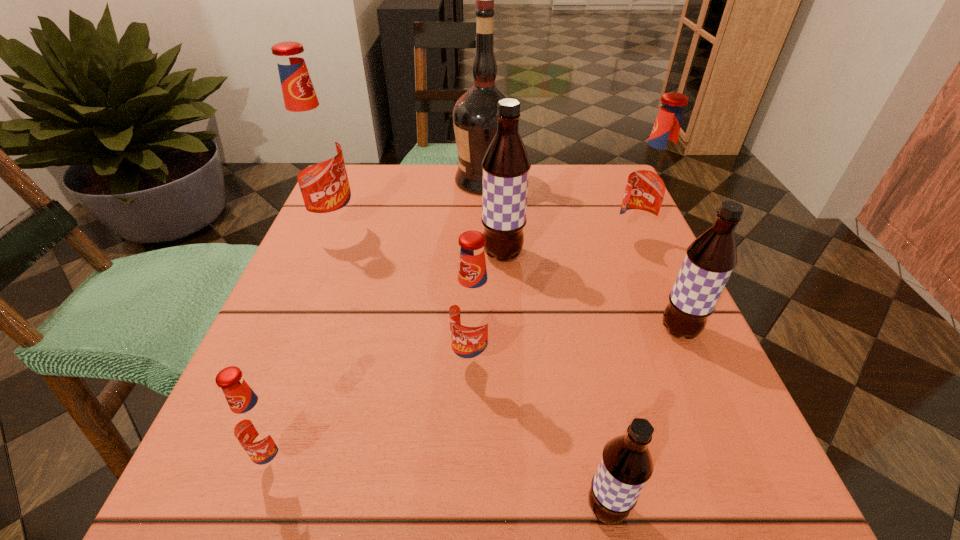
Where is `blank space located on the right of the second nearest red root beer`? blank space located on the right of the second nearest red root beer is located at coordinates (711, 363).

Identify the location of free space located 0.240m on the right of the second nearest root beer. (487, 460).

You are a GUI agent. You are given a task and a screenshot of the screen. Output one action in this format:
    pyautogui.click(x=<x>, y=<y>)
    Task: Click on the vacant region located on the back of the third object from right to left
    
    Given the screenshot: What is the action you would take?
    [x=585, y=400]

Locate an element on the screen. The width and height of the screenshot is (960, 540). liquor positioned at the far edge is located at coordinates (474, 115).

This screenshot has width=960, height=540. Find the location of `root beer at the far edge`. root beer at the far edge is located at coordinates (314, 153).

You are a GUI agent. You are given a task and a screenshot of the screen. Output one action in this format:
    pyautogui.click(x=<x>, y=<y>)
    Task: Click on the object located in the far left corner section of the desktop
    The width and height of the screenshot is (960, 540).
    Given the screenshot: What is the action you would take?
    pyautogui.click(x=314, y=153)

Identify the location of object located in the near left corner section of the desktop. This screenshot has width=960, height=540. (257, 424).

Where is `free spot at the far edge of the desktop`? The image size is (960, 540). free spot at the far edge of the desktop is located at coordinates (555, 186).

You are a GUI agent. You are given a task and a screenshot of the screen. Output one action in this format:
    pyautogui.click(x=<x>, y=<y>)
    Task: Click on the vacant space at the near edge of the desktop
    Image resolution: width=960 pixels, height=540 pixels.
    Given the screenshot: What is the action you would take?
    tap(457, 505)

In the image, there is a desktop. Identify the location of vacant space at the left edge. (303, 252).